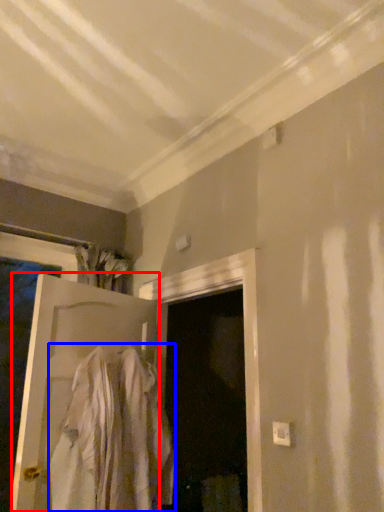
Question: Among these objects, which one is farthest to the camera, door (highlighted by a red box) or clothing (highlighted by a blue box)?

Choices:
 (A) door
 (B) clothing

Answer: (A)